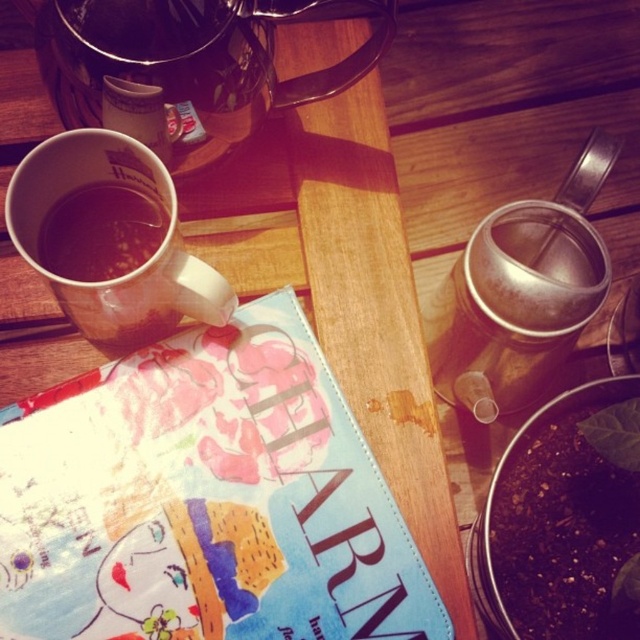
In the scene shown: Can you confirm if brushed metal teapot at upper left is wider than brown matte cup at left?

Indeed, brushed metal teapot at upper left has a greater width compared to brown matte cup at left.

Is brushed metal teapot at upper left bigger than brown matte cup at left?

Indeed, brushed metal teapot at upper left has a larger size compared to brown matte cup at left.

Is point (209, 36) behind point (67, 237)?

No, it is not.

Image resolution: width=640 pixels, height=640 pixels. Identify the location of brushed metal teapot at upper left. (189, 52).

Which is behind, point (148, 196) or point (106, 189)?

Point (148, 196)

Is matte ceramic mug at left closer to the viewer compared to brown matte cup at left?

Yes, it is in front of brown matte cup at left.

Which is behind, point (106, 180) or point (147, 250)?

Positioned behind is point (147, 250).

Where is `matte ceramic mug at left`? matte ceramic mug at left is located at coordinates (129, 269).

Does brushed metal teapot at upper left appear over matte ceramic mug at left?

Yes, brushed metal teapot at upper left is above matte ceramic mug at left.

Does brushed metal teapot at upper left have a smaller size compared to matte ceramic mug at left?

No.

Locate an element on the screen. The image size is (640, 640). brushed metal teapot at upper left is located at coordinates (189, 52).